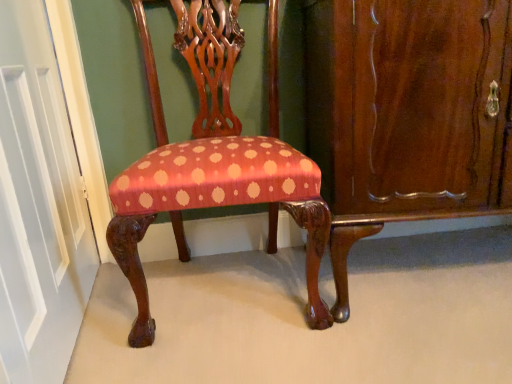
Question: Is silky red fabric chair at center positioned far away from white painted wood door at left?

Choices:
 (A) yes
 (B) no

Answer: (B)

Question: Is silky red fabric chair at center at the left side of white painted wood door at left?

Choices:
 (A) yes
 (B) no

Answer: (B)

Question: From a real-world perspective, is silky red fabric chair at center physically above white painted wood door at left?

Choices:
 (A) yes
 (B) no

Answer: (B)

Question: Does silky red fabric chair at center come in front of white painted wood door at left?

Choices:
 (A) yes
 (B) no

Answer: (B)

Question: Considering the relative sizes of silky red fabric chair at center and white painted wood door at left in the image provided, is silky red fabric chair at center smaller than white painted wood door at left?

Choices:
 (A) yes
 (B) no

Answer: (B)

Question: Which is correct: mahogany wood dresser at right is inside white painted wood door at left, or outside of it?

Choices:
 (A) outside
 (B) inside

Answer: (A)

Question: Is mahogany wood dresser at right wider or thinner than white painted wood door at left?

Choices:
 (A) thin
 (B) wide

Answer: (B)

Question: From a real-world perspective, relative to white painted wood door at left, is mahogany wood dresser at right vertically above or below?

Choices:
 (A) above
 (B) below

Answer: (B)

Question: In the image, is mahogany wood dresser at right positioned in front of or behind white painted wood door at left?

Choices:
 (A) behind
 (B) front

Answer: (A)

Question: In terms of height, does silky red fabric chair at center look taller or shorter compared to mahogany wood dresser at right?

Choices:
 (A) tall
 (B) short

Answer: (A)

Question: Considering the positions of point (151, 193) and point (358, 4), is point (151, 193) closer or farther from the camera than point (358, 4)?

Choices:
 (A) farther
 (B) closer

Answer: (A)

Question: Is silky red fabric chair at center inside the boundaries of mahogany wood dresser at right, or outside?

Choices:
 (A) outside
 (B) inside

Answer: (A)

Question: In the image, is silky red fabric chair at center on the left side or the right side of mahogany wood dresser at right?

Choices:
 (A) right
 (B) left

Answer: (B)

Question: Is point (472, 6) closer or farther from the camera than point (147, 86)?

Choices:
 (A) farther
 (B) closer

Answer: (B)

Question: In the image, is mahogany wood dresser at right positioned in front of or behind silky red fabric chair at center?

Choices:
 (A) behind
 (B) front

Answer: (A)